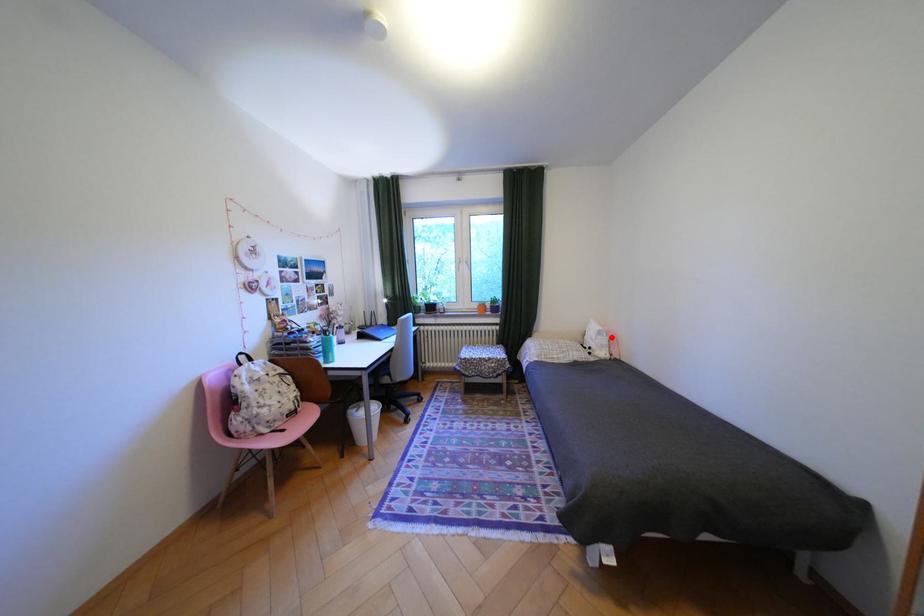
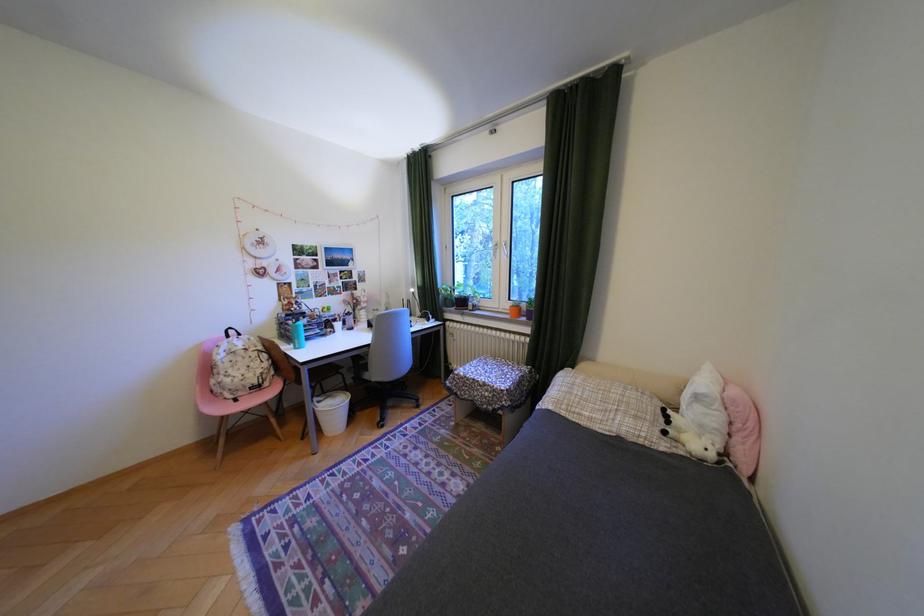
Locate, in the second image, the point that corresponds to the highlighted location in the first image.

(710, 408)